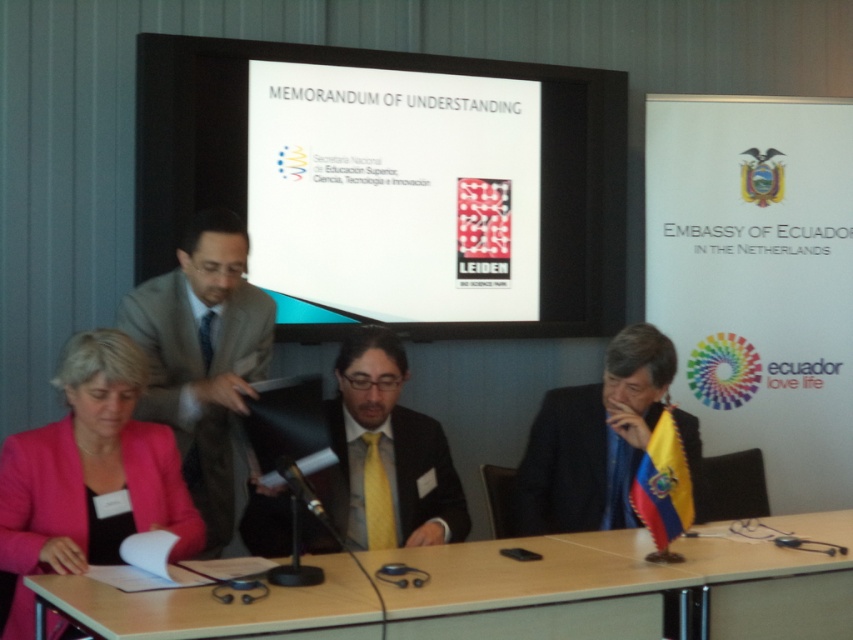
Does point (614, 90) lie behind point (106, 484)?

Yes, it is.

The height and width of the screenshot is (640, 853). What do you see at coordinates (412, 77) in the screenshot? I see `white glossy projection screen at upper center` at bounding box center [412, 77].

The width and height of the screenshot is (853, 640). What are the coordinates of `white glossy projection screen at upper center` in the screenshot? It's located at [x=412, y=77].

Measure the distance between light gray wool suit at left and camera.

light gray wool suit at left is 2.78 meters away from camera.

Which is more to the right, light gray wool suit at left or matte black suit at center?

From the viewer's perspective, matte black suit at center appears more on the right side.

I want to click on light gray wool suit at left, so click(198, 380).

Locate an element on the screen. The height and width of the screenshot is (640, 853). light gray wool suit at left is located at coordinates click(x=198, y=380).

Does point (572, 104) lie behind point (328, 400)?

Yes, point (572, 104) is behind point (328, 400).

Is white glossy projection screen at upper center taller than matte black suit at center?

Indeed, white glossy projection screen at upper center has a greater height compared to matte black suit at center.

Consider the image. Who is more forward, (x=392, y=180) or (x=428, y=454)?

Point (x=428, y=454) is more forward.

Locate an element on the screen. The height and width of the screenshot is (640, 853). white glossy projection screen at upper center is located at coordinates 412,77.